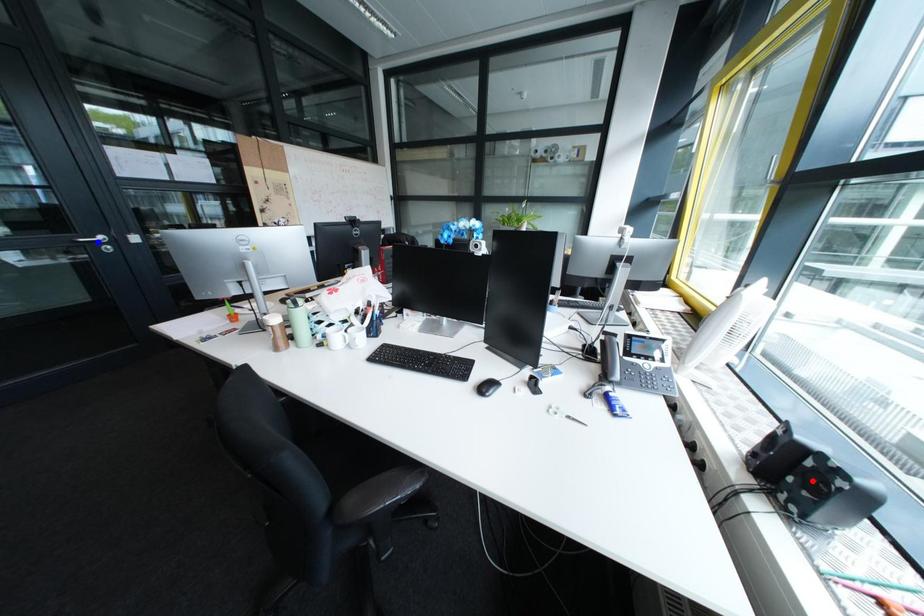
Question: Two points are marked on the image. Which point is closer to the camera?

Choices:
 (A) Blue point is closer.
 (B) Red point is closer.

Answer: (B)